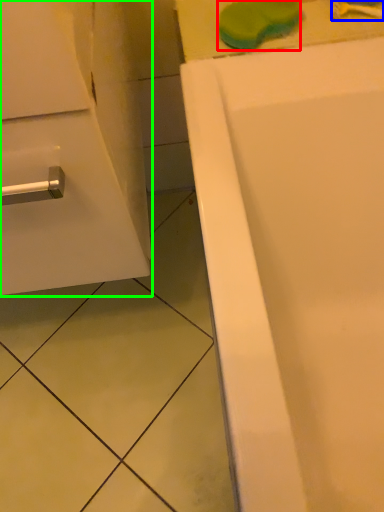
Question: Based on their relative distances, which object is nearer to soap (highlighted by a red box)? Choose from toothbrush (highlighted by a blue box) and bathroom cabinet (highlighted by a green box).

Choices:
 (A) toothbrush
 (B) bathroom cabinet

Answer: (A)